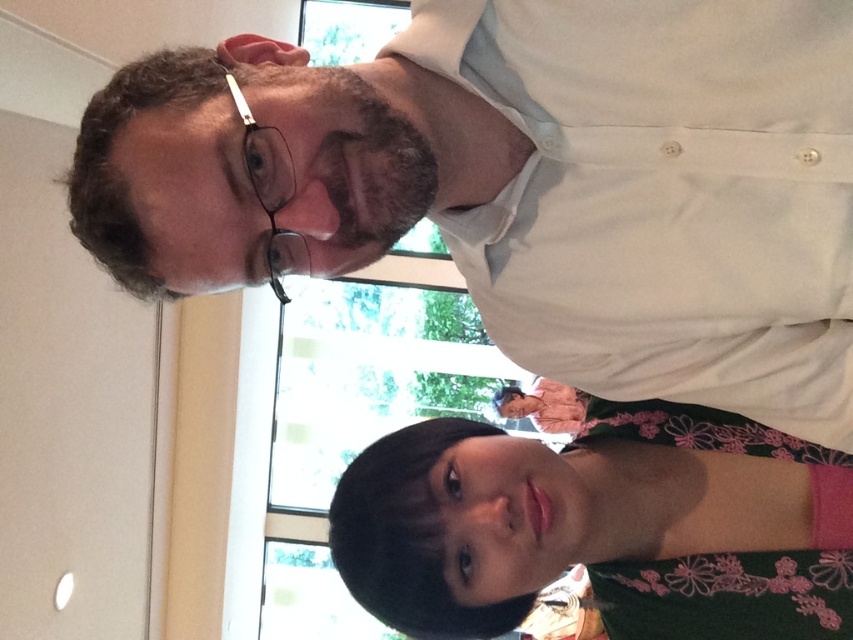
You are a photographer trying to capture a portrait of both the white matte shirt at upper center and the dark green floral dress at lower center. Since you want to ensure both are in focus, you need to know their relative positions. Which object is closer to you?

The white matte shirt at upper center is closer to the viewer than the dark green floral dress at lower center, so it will be in focus first.

Looking at this image, you are a photographer setting up a shoot in this room. You need to place a backdrop that is 1.2 meters wide. Which of the two items, the white matte shirt at upper center or the dark green floral dress at lower center, would require a wider backdrop to fully capture its width?

The white matte shirt at upper center has a larger width than the dark green floral dress at lower center, so it would require a wider backdrop to fully capture its width.